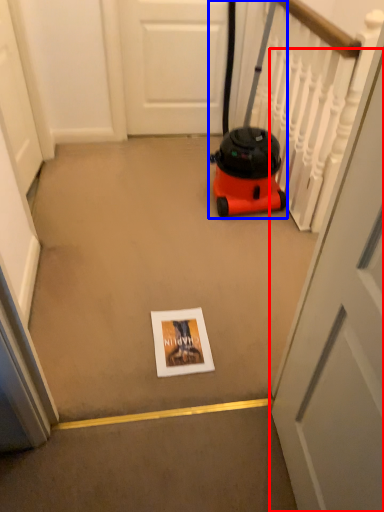
Question: Which of the following is the farthest to the observer, door (highlighted by a red box) or equipment (highlighted by a blue box)?

Choices:
 (A) door
 (B) equipment

Answer: (B)